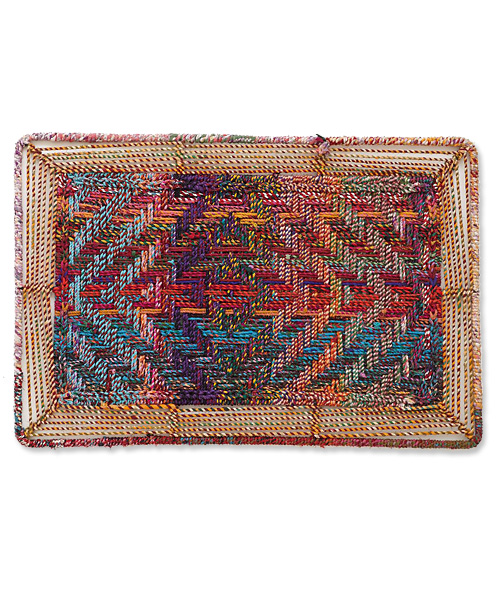
Image resolution: width=500 pixels, height=600 pixels. Identify the location of floor or wall. (148, 468), (213, 92).